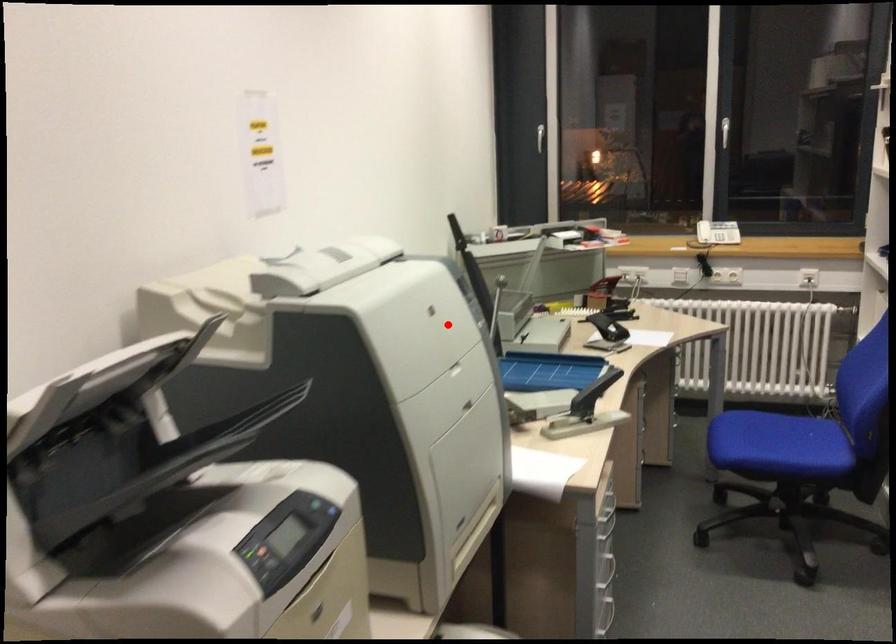
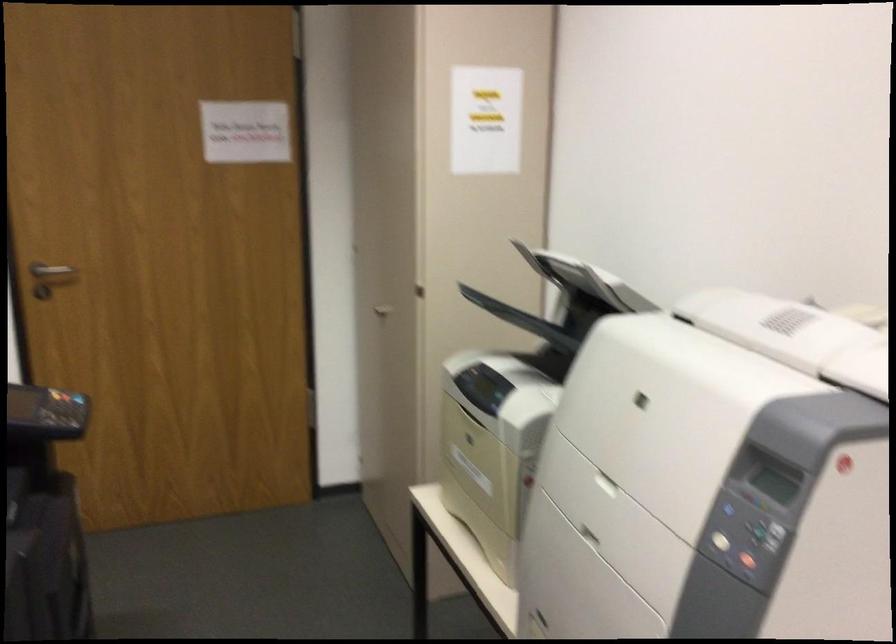
In the second image, find the point that corresponds to the highlighted location in the first image.

(754, 524)